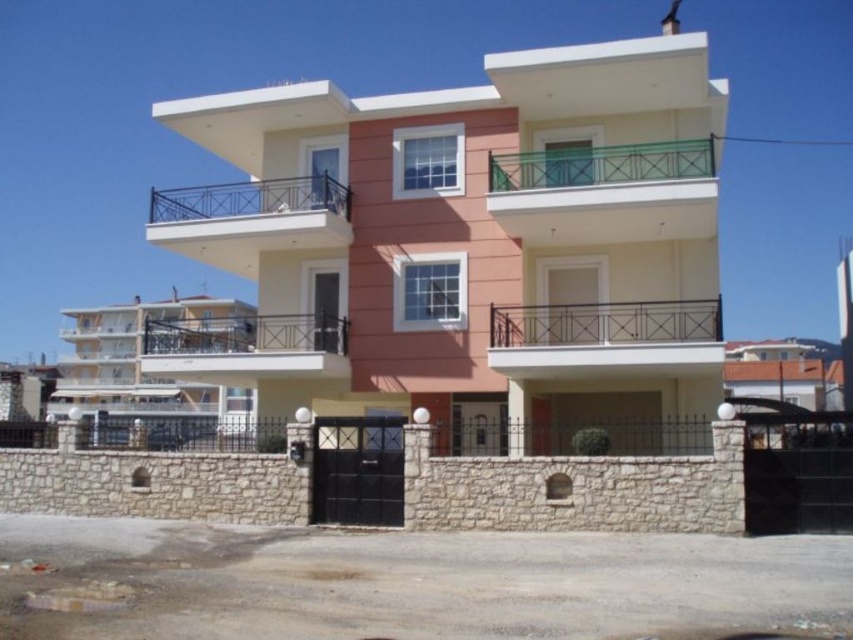
Between point (222, 328) and point (619, 168), which one is positioned behind?

The point (222, 328) is behind.

The width and height of the screenshot is (853, 640). In order to click on white matte balcony at center in this screenshot , I will do `click(247, 346)`.

Who is more forward, (502, 336) or (527, 173)?

Point (502, 336)

Can you confirm if white wrought iron balcony at center is shorter than green metal railing at upper center?

Indeed, white wrought iron balcony at center has a lesser height compared to green metal railing at upper center.

Is point (521, 316) in front of point (511, 157)?

No, (521, 316) is further to viewer.

You are a GUI agent. You are given a task and a screenshot of the screen. Output one action in this format:
    pyautogui.click(x=<x>, y=<y>)
    Task: Click on the white wrought iron balcony at center
    The height and width of the screenshot is (640, 853).
    Given the screenshot: What is the action you would take?
    pyautogui.click(x=602, y=337)

Which is in front, point (531, 348) or point (163, 221)?

Point (531, 348)

Between white wrought iron balcony at center and black metal railing at upper center, which one appears on the right side from the viewer's perspective?

white wrought iron balcony at center is more to the right.

At what (x,y) coordinates should I click in order to perform the action: click on white wrought iron balcony at center. Please return your answer as a coordinate pair (x, y). Looking at the image, I should click on (602, 337).